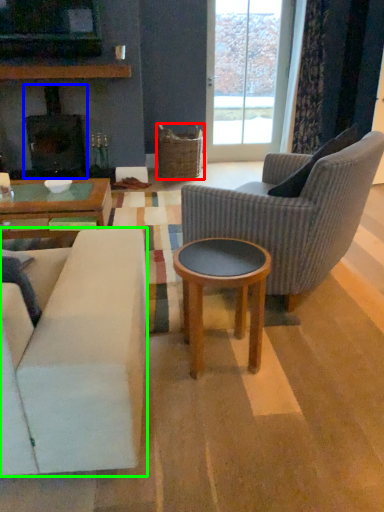
Question: Which is nearer to the picnic basket (highlighted by a red box)? fireplace (highlighted by a blue box) or studio couch (highlighted by a green box).

Choices:
 (A) fireplace
 (B) studio couch

Answer: (A)